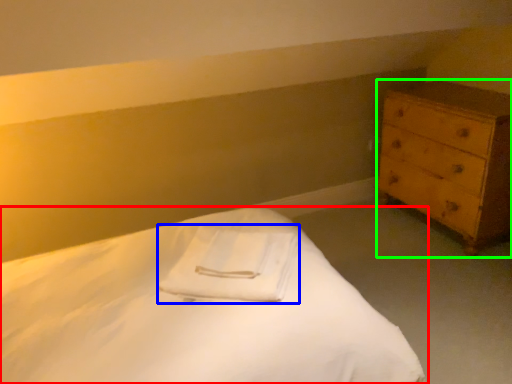
Question: Which object is positioned closest to bed (highlighted by a red box)? Select from cloth (highlighted by a blue box) and chest of drawers (highlighted by a green box).

Choices:
 (A) cloth
 (B) chest of drawers

Answer: (A)